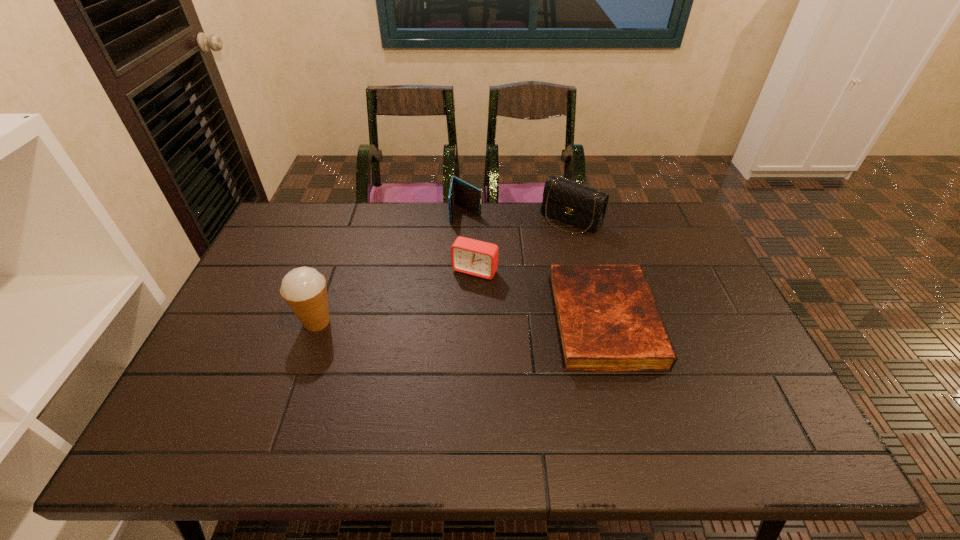
The image size is (960, 540). Identify the location of free location at the near edge of the desktop. tap(684, 410).

You are a GUI agent. You are given a task and a screenshot of the screen. Output one action in this format:
    pyautogui.click(x=<x>, y=<y>)
    Task: Click on the vacant space at the right edge
    The width and height of the screenshot is (960, 540).
    Given the screenshot: What is the action you would take?
    pyautogui.click(x=723, y=300)

Locate an element on the screen. The height and width of the screenshot is (540, 960). vacant space at the far left corner is located at coordinates (286, 217).

At what (x,y) coordinates should I click in order to perform the action: click on vacant area at the far right corner of the desktop. Please return your answer as a coordinate pair (x, y). The image size is (960, 540). Looking at the image, I should click on (667, 231).

Locate an element on the screen. This screenshot has width=960, height=540. free area in between the clutch bag and the alarm clock is located at coordinates (523, 245).

The width and height of the screenshot is (960, 540). I want to click on empty location between the second tallest object and the leftmost object, so click(444, 271).

This screenshot has width=960, height=540. I want to click on vacant region between the alarm clock and the icecream, so click(x=396, y=296).

Locate an element on the screen. Image resolution: width=960 pixels, height=540 pixels. unoccupied area between the wallet and the icecream is located at coordinates (392, 267).

You are a GUI agent. You are given a task and a screenshot of the screen. Output one action in this format:
    pyautogui.click(x=<x>, y=<y>)
    Task: Click on the free area in between the wallet and the fourth shortest object
    This screenshot has height=540, width=960.
    Given the screenshot: What is the action you would take?
    pyautogui.click(x=518, y=216)

Where is `free space that is in between the alarm clock and the clutch bag`? Image resolution: width=960 pixels, height=540 pixels. free space that is in between the alarm clock and the clutch bag is located at coordinates (523, 245).